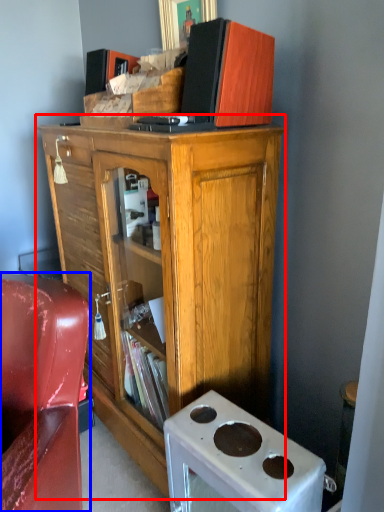
Question: Which object is further to the camera taking this photo, cabinetry (highlighted by a red box) or chair (highlighted by a blue box)?

Choices:
 (A) cabinetry
 (B) chair

Answer: (A)